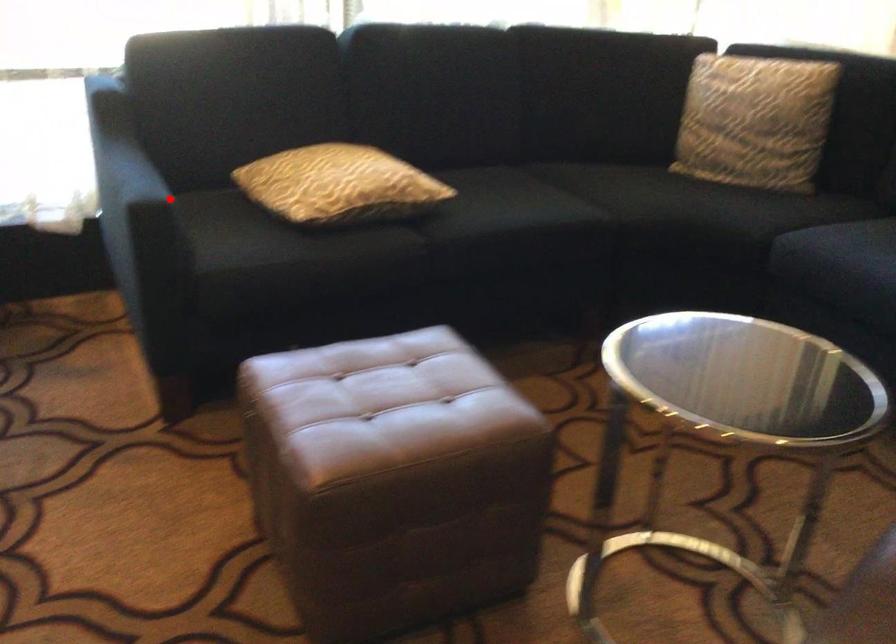
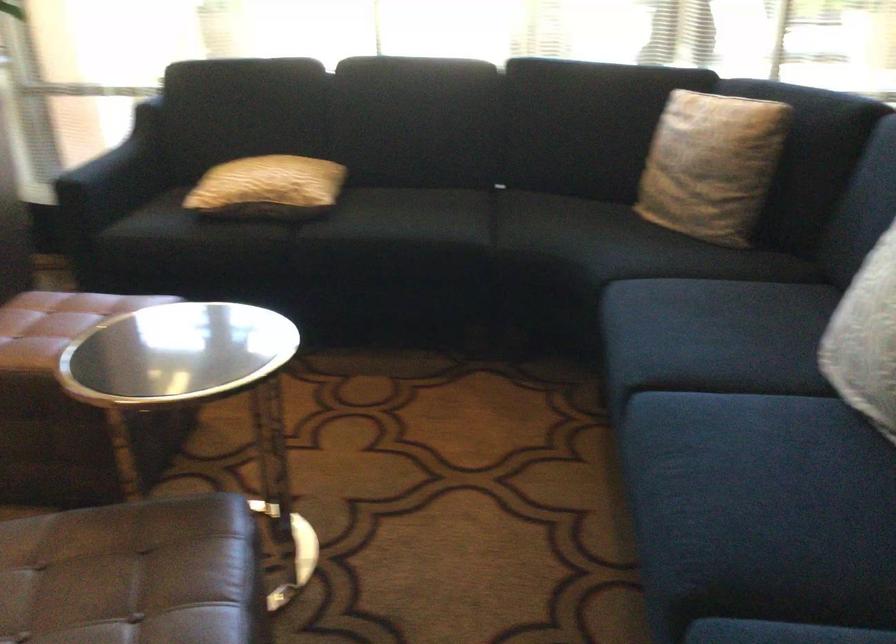
Question: I am providing you with two images of the same scene from different viewpoints. In image1, a red point is highlighted. Considering the same 3D point in image2, which of the following is correct?

Choices:
 (A) It is closer
 (B) It is farther

Answer: (B)